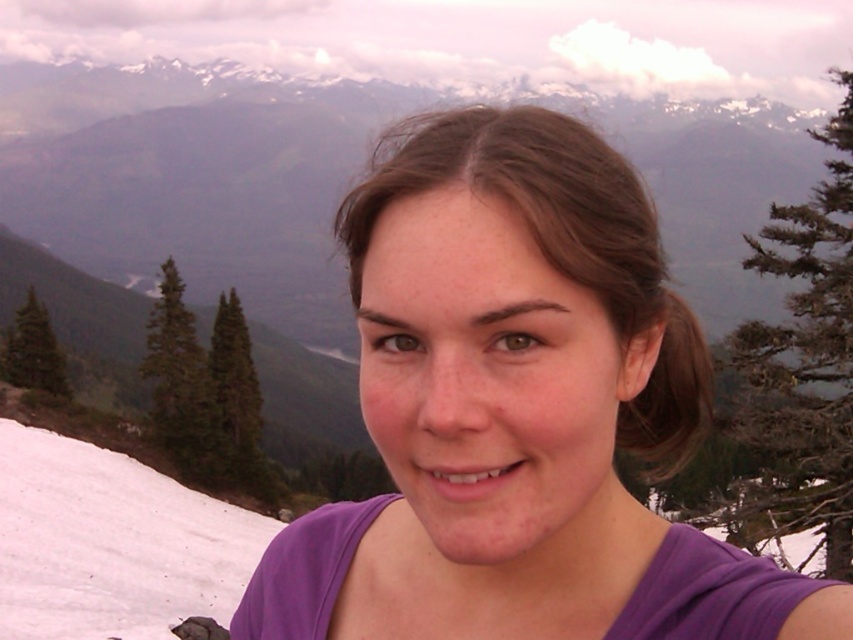
You are planning to take a photo in the same spot as the person in the image. You want to ensure that both the green textured pine tree at left and the green matte pine at left are visible in your photo. Given their height difference, which pine tree will appear larger in your photo?

The green textured pine tree at left will appear larger in your photo because it is much taller than the green matte pine at left.

You are a photographer trying to capture the scenic mountain backdrop while ensuring both green textured pine tree at left and green matte pine at left are visible in your shot. Which pine tree should you position closer to the camera to frame the mountains better?

To frame the mountains better, position the green textured pine tree at left closer to the camera since it is already on the right side of the green matte pine at left, allowing both to be included in the shot while maintaining the scenic backdrop.

You are planning to take a photo similar to the one described. You want to ensure that both the white snow at lower left and the green matte pine at center are clearly visible in your shot. Based on their positions, which object should you focus on to ensure both are in focus?

Since the white snow at lower left is in front of the green matte pine at center, focusing on the green matte pine at center will ensure both are in focus as it is the farther object. This technique, known as the hyperfocal distance, maximizes the depth of field so both foreground and background elements are sharp.